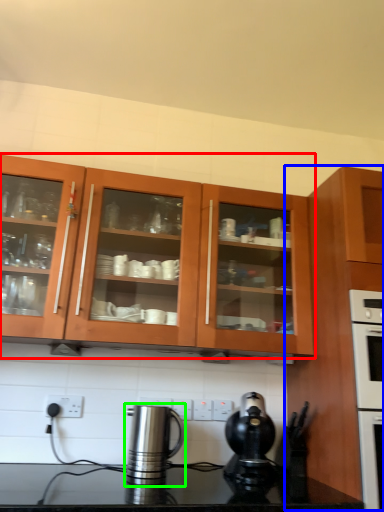
Question: Which object is positioned closest to cabinetry (highlighted by a red box)? Select from cabinetry (highlighted by a blue box) and kitchen appliance (highlighted by a green box).

Choices:
 (A) cabinetry
 (B) kitchen appliance

Answer: (A)